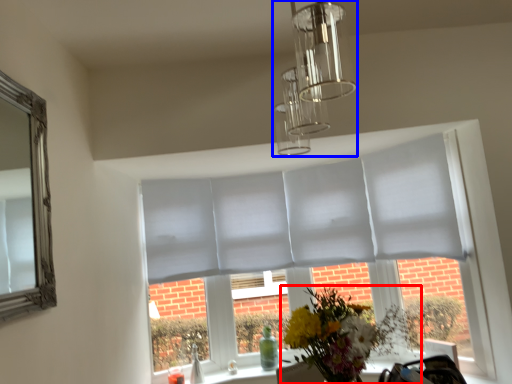
Question: Which object is further to the camera taking this photo, flower (highlighted by a red box) or light fixture (highlighted by a blue box)?

Choices:
 (A) flower
 (B) light fixture

Answer: (A)